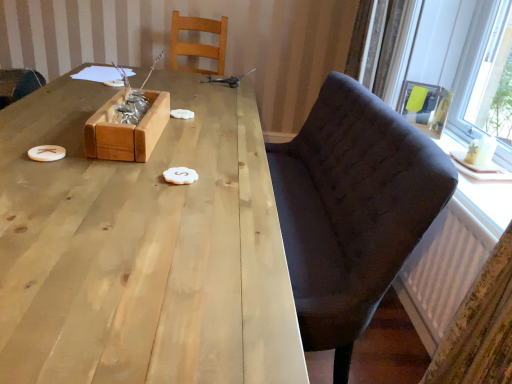
Question: From a real-world perspective, is matte black armchair at upper right under white matte cookie at center, which is the 1th food from front to back?

Choices:
 (A) no
 (B) yes

Answer: (A)

Question: Is matte black armchair at upper right next to white matte cookie at center, the first food in the right-to-left sequence, and touching it?

Choices:
 (A) yes
 (B) no

Answer: (B)

Question: Does matte black armchair at upper right have a lesser height compared to white matte cookie at center, the second food in the left-to-right sequence?

Choices:
 (A) yes
 (B) no

Answer: (B)

Question: Is matte black armchair at upper right thinner than white matte cookie at center, the second food in the left-to-right sequence?

Choices:
 (A) yes
 (B) no

Answer: (A)

Question: Is matte black armchair at upper right completely or partially outside of white matte cookie at center, marked as the 1th food in a bottom-to-top arrangement?

Choices:
 (A) yes
 (B) no

Answer: (A)

Question: Are matte black armchair at upper right and white matte cookie at center, which is the 1th food from front to back, located far from each other?

Choices:
 (A) yes
 (B) no

Answer: (A)

Question: Is white matte cookie at center, the second food in the left-to-right sequence, completely or partially outside of dark fabric chair at right, the third chair positioned from the left?

Choices:
 (A) no
 (B) yes

Answer: (B)

Question: Can you confirm if white matte cookie at center, which is counted as the 2th food, starting from the back, is taller than dark fabric chair at right, which ranks as the 1th chair in right-to-left order?

Choices:
 (A) yes
 (B) no

Answer: (B)

Question: Is white matte cookie at center, the second food in the left-to-right sequence, turned away from dark fabric chair at right, which ranks as the 1th chair in right-to-left order?

Choices:
 (A) yes
 (B) no

Answer: (A)

Question: Can dark fabric chair at right, which ranks as the 1th chair in right-to-left order, be found inside white matte cookie at center, which is the 1th food from front to back?

Choices:
 (A) no
 (B) yes

Answer: (A)

Question: Can you confirm if white matte cookie at center, which is the second food from top to bottom, is positioned to the left of dark fabric chair at right, the third chair positioned from the left?

Choices:
 (A) yes
 (B) no

Answer: (A)

Question: From the image's perspective, is white matte cookie at center, the first food in the right-to-left sequence, located beneath dark fabric chair at right, the third chair positioned from the left?

Choices:
 (A) yes
 (B) no

Answer: (B)

Question: From a real-world perspective, is wooden chair at left, the first chair in the left-to-right sequence, positioned over matte black armchair at upper right based on gravity?

Choices:
 (A) yes
 (B) no

Answer: (B)